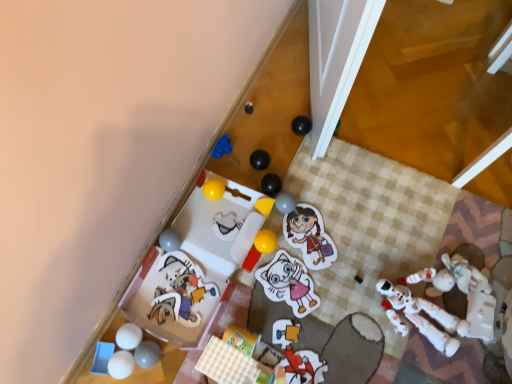
At what (x,y) coordinates should I click in order to perform the action: click on vacant space behind white rubber ball at lower left, which is the fourteenth toy from right to left. Please return your answer as a coordinate pair (x, y). The width and height of the screenshot is (512, 384). Looking at the image, I should click on (150, 306).